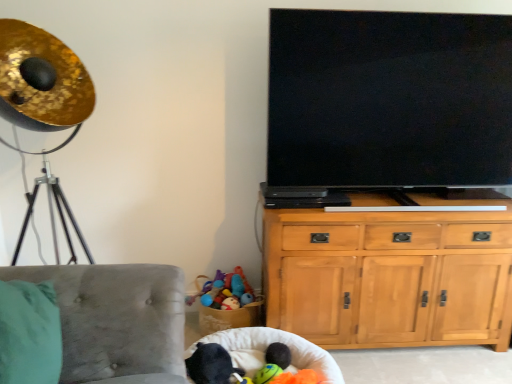
Question: Could flat screen tv at upper right be considered to be inside black plush toy at lower center?

Choices:
 (A) yes
 (B) no

Answer: (B)

Question: Is black plush toy at lower center smaller than flat screen tv at upper right?

Choices:
 (A) yes
 (B) no

Answer: (A)

Question: Is black plush toy at lower center positioned in front of flat screen tv at upper right?

Choices:
 (A) no
 (B) yes

Answer: (B)

Question: From a real-world perspective, is black plush toy at lower center located beneath flat screen tv at upper right?

Choices:
 (A) no
 (B) yes

Answer: (B)

Question: Is black plush toy at lower center wider than flat screen tv at upper right?

Choices:
 (A) no
 (B) yes

Answer: (B)

Question: From the image's perspective, is velvet grey chair at lower left above or below light wood cabinet at center right?

Choices:
 (A) below
 (B) above

Answer: (A)

Question: Would you say velvet grey chair at lower left is to the left or to the right of light wood cabinet at center right in the picture?

Choices:
 (A) left
 (B) right

Answer: (A)

Question: In terms of height, does velvet grey chair at lower left look taller or shorter compared to light wood cabinet at center right?

Choices:
 (A) short
 (B) tall

Answer: (A)

Question: Considering their positions, is velvet grey chair at lower left located in front of or behind light wood cabinet at center right?

Choices:
 (A) front
 (B) behind

Answer: (A)

Question: Is velvet grey chair at lower left taller or shorter than soft plush toy at lower center?

Choices:
 (A) tall
 (B) short

Answer: (A)

Question: Considering the positions of velvet grey chair at lower left and soft plush toy at lower center in the image, is velvet grey chair at lower left bigger or smaller than soft plush toy at lower center?

Choices:
 (A) small
 (B) big

Answer: (B)

Question: Visually, is velvet grey chair at lower left positioned to the left or to the right of soft plush toy at lower center?

Choices:
 (A) left
 (B) right

Answer: (A)

Question: From the image's perspective, is velvet grey chair at lower left located above or below soft plush toy at lower center?

Choices:
 (A) above
 (B) below

Answer: (A)

Question: Is white fabric bean bag at lower center inside the boundaries of light wood cabinet at center right, or outside?

Choices:
 (A) outside
 (B) inside

Answer: (A)

Question: Looking at the image, does white fabric bean bag at lower center seem bigger or smaller compared to light wood cabinet at center right?

Choices:
 (A) big
 (B) small

Answer: (B)